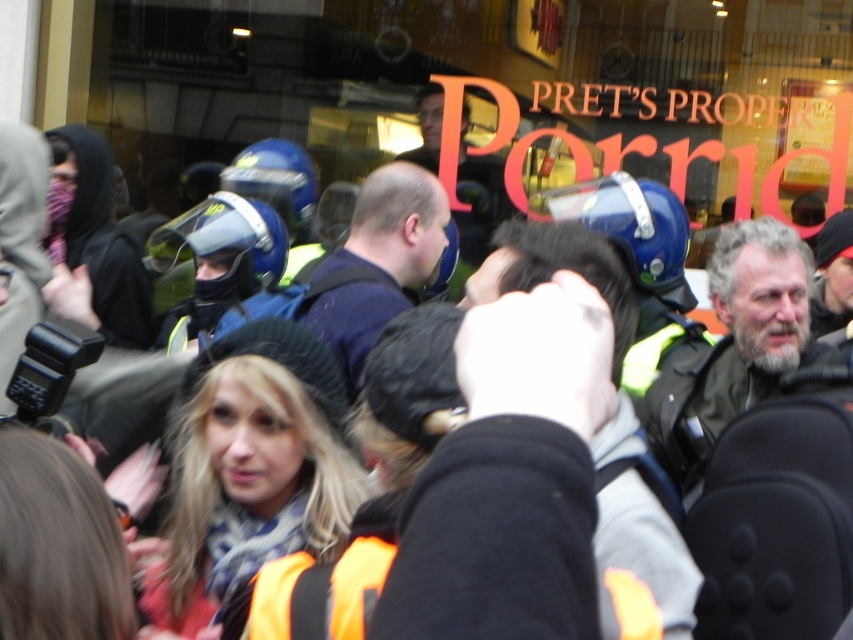
You are a photographer trying to capture the crowd in the protest scene. You notice a person with a gray beard at center and another wearing a dark blue shirt at center. Which of these two individuals is positioned lower in the image?

The gray beard at center is located below the dark blue shirt at center, so the person with the gray beard at center is positioned lower in the image.

Based on the photo, you are a photographer trying to capture a candid shot of the gray beard at center and the dark blue shirt at center in the crowded scene. If your camera has a minimum focusing distance of 6 feet, will you be able to take the photo without moving closer?

The gray beard at center is 6.20 feet from the dark blue shirt at center. Since the minimum focusing distance is 6 feet, the photographer can take the photo without moving closer because the distance between them is slightly more than the required minimum focusing distance.

You are a photographer trying to capture a candid shot of the gray beard at center and the dark blue shirt at center in the crowded scene. Since you want to ensure both subjects are in focus, which subject should you prioritize focusing on first to account for their size difference?

The gray beard at center has a smaller size compared to dark blue shirt at center, so you should prioritize focusing on the dark blue shirt at center first as it is larger and more likely to be in focus given its prominence in the frame.